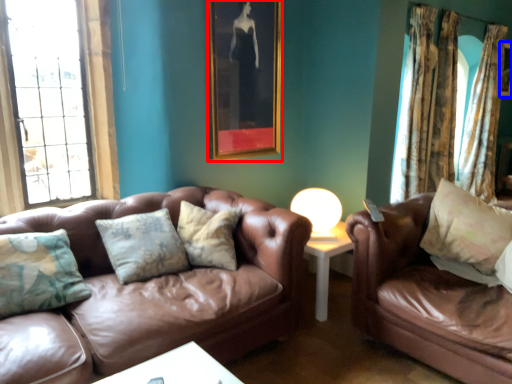
Question: Which point is closer to the camera, picture frame (highlighted by a red box) or picture frame (highlighted by a blue box)?

Choices:
 (A) picture frame
 (B) picture frame

Answer: (A)